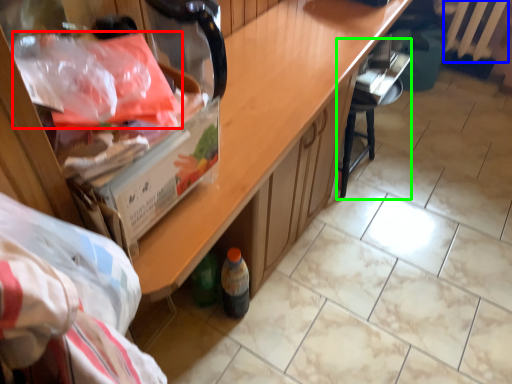
Question: Which object is the farthest from material (highlighted by a red box)? Choose among these: radiator (highlighted by a blue box) or chair (highlighted by a green box).

Choices:
 (A) radiator
 (B) chair

Answer: (A)